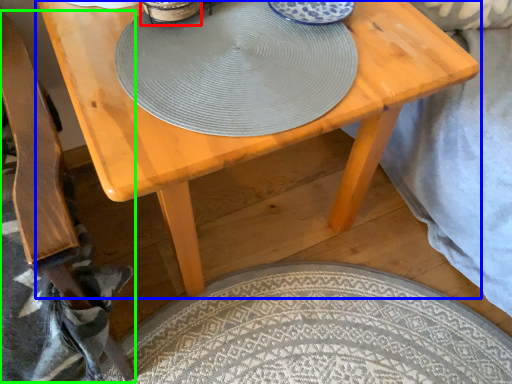
Question: Which object is positioned farthest from tableware (highlighted by a red box)? Select from table (highlighted by a blue box) and armchair (highlighted by a green box).

Choices:
 (A) table
 (B) armchair

Answer: (A)